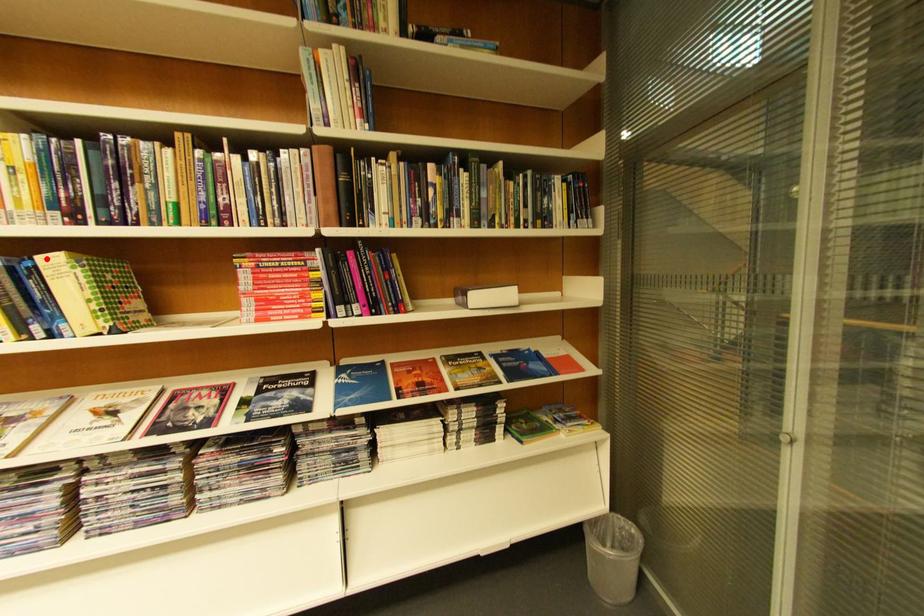
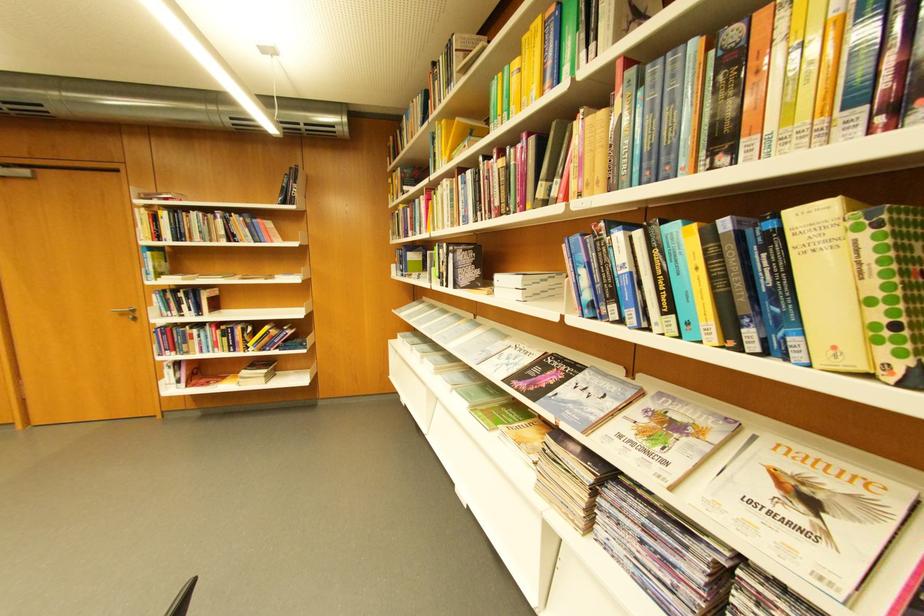
Find the pixel in the second image that matches the highlighted location in the first image.

(796, 214)